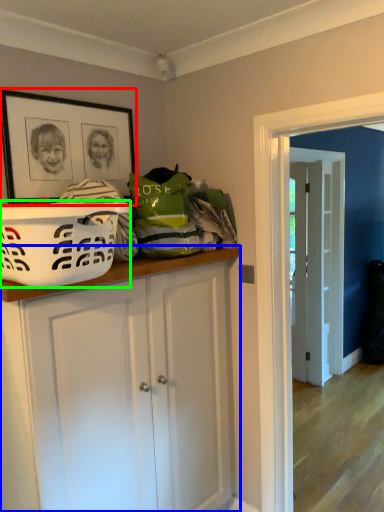
Question: Estimate the real-world distances between objects in this image. Which object is farther from picture frame (highlighted by a red box), cabinetry (highlighted by a blue box) or basket (highlighted by a green box)?

Choices:
 (A) cabinetry
 (B) basket

Answer: (A)